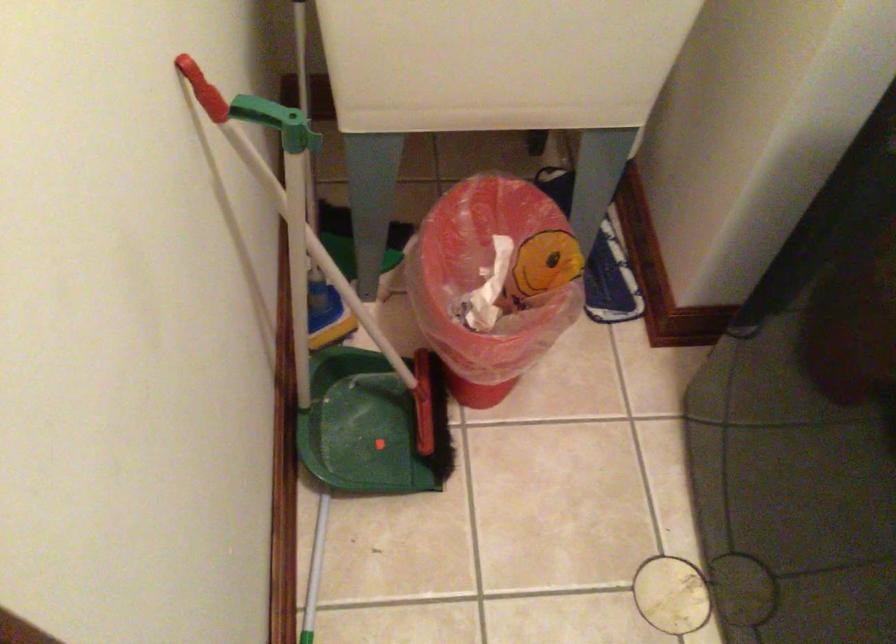
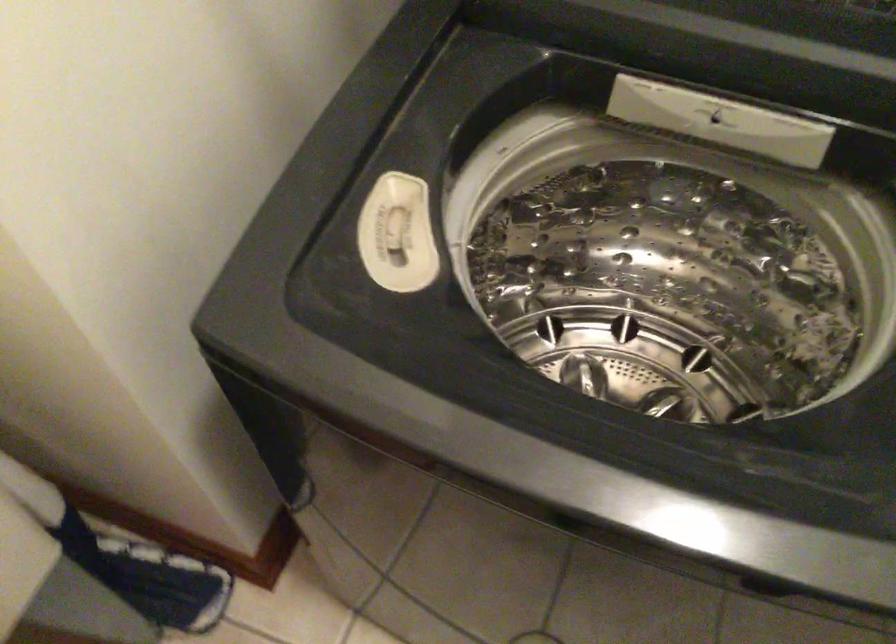
In the second image, find the point that corresponds to point (604, 239) in the first image.

(125, 560)